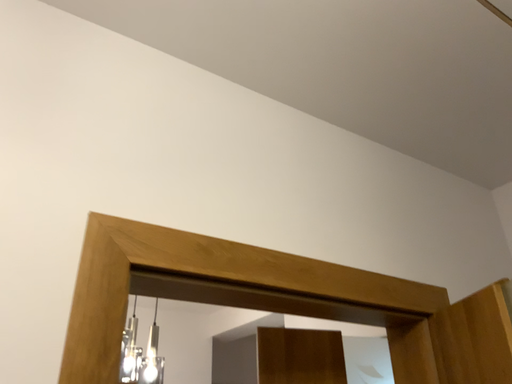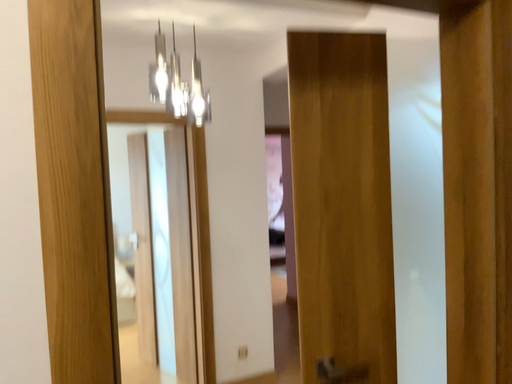
Question: Which way did the camera rotate in the video?

Choices:
 (A) rotated right
 (B) rotated left

Answer: (B)